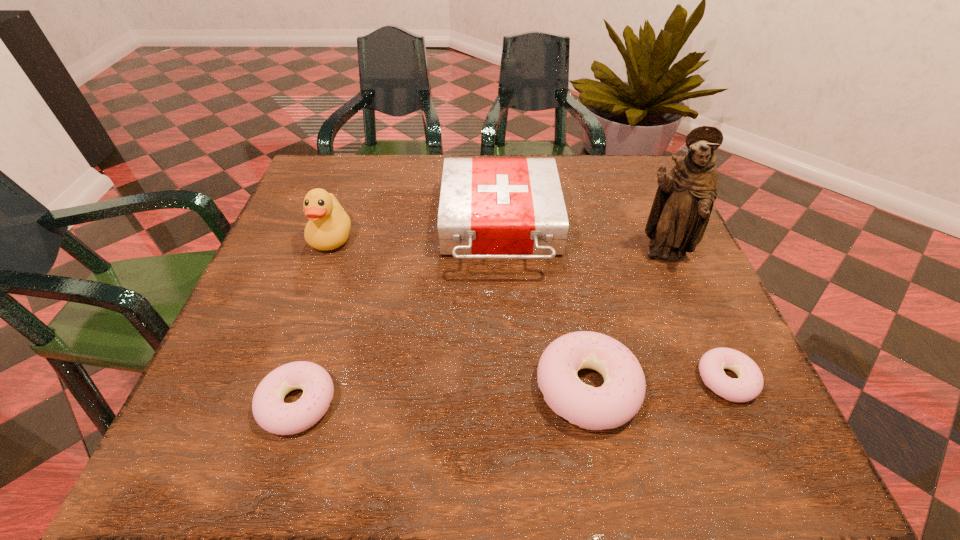
To achieve uniform spacing by inserting another doughnut among them, please point to a free space for this new doughnut. Please provide its 2D coordinates. Your answer should be formatted as a tuple, i.e. [(x, y)], where the tuple contains the x and y coordinates of a point satisfying the conditions above.

[(444, 395)]